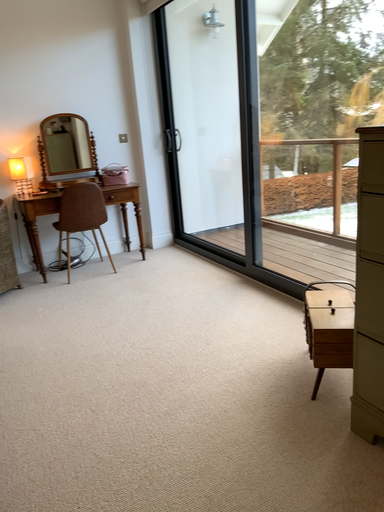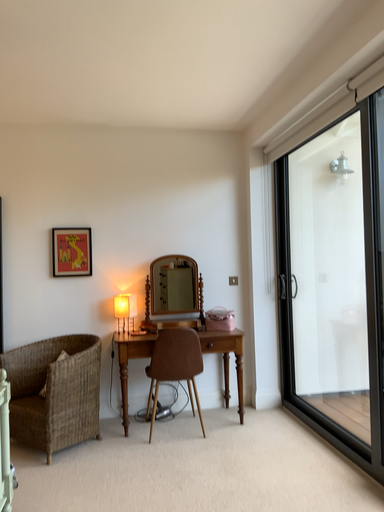
Question: Which way did the camera rotate in the video?

Choices:
 (A) rotated left
 (B) rotated right

Answer: (A)